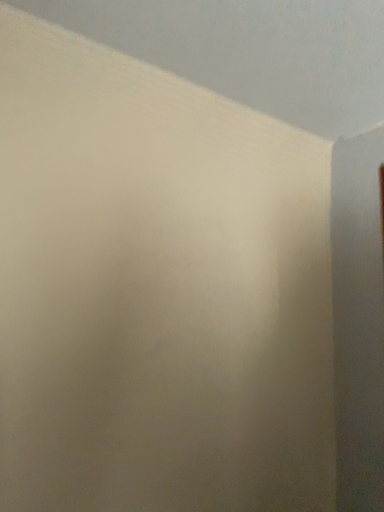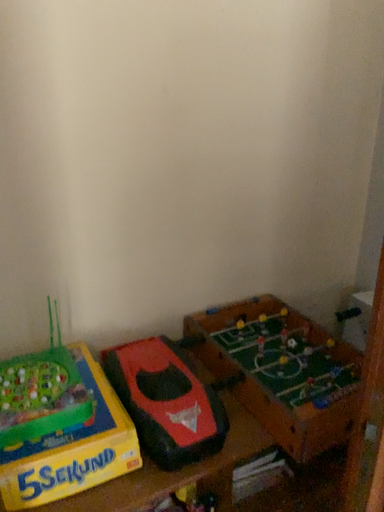
Question: How did the camera likely rotate when shooting the video?

Choices:
 (A) rotated downward
 (B) rotated upward

Answer: (A)